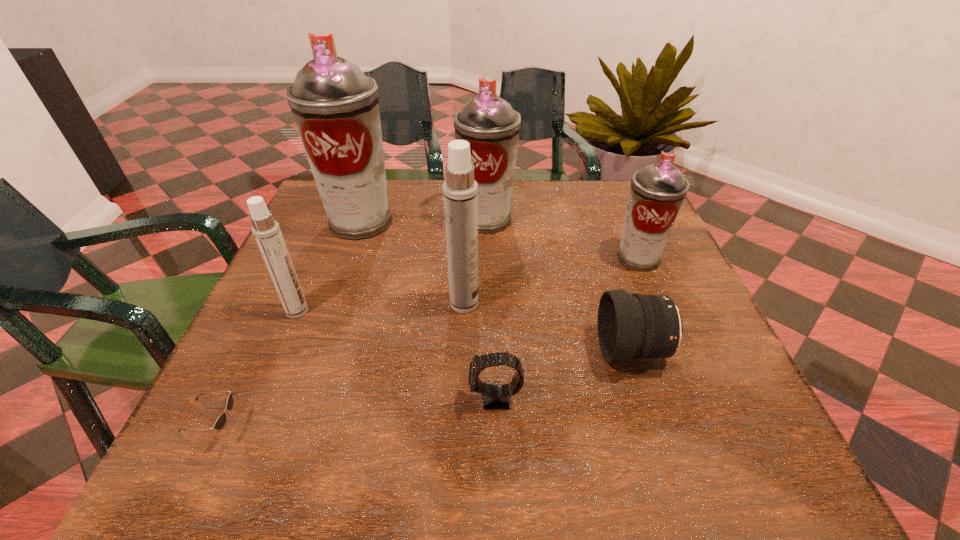
Locate an element on the screen. free spot between the sunglasses and the telephoto lens is located at coordinates (426, 390).

Image resolution: width=960 pixels, height=540 pixels. I want to click on vacant point located between the sunglasses and the telephoto lens, so click(426, 390).

This screenshot has height=540, width=960. In order to click on free spot between the smaller white aerosol can and the sunglasses in this screenshot , I will do tap(258, 370).

Find the location of a particular element. This screenshot has width=960, height=540. free space between the biggest gray aerosol can and the sunglasses is located at coordinates (290, 325).

What are the coordinates of `unoccupied position between the bigger white aerosol can and the leftmost gray aerosol can` in the screenshot? It's located at (412, 262).

Select which object appears as the sixth closest to the third nearest object. Please provide its 2D coordinates. Your answer should be formatted as a tuple, i.e. [(x, y)], where the tuple contains the x and y coordinates of a point satisfying the conditions above.

[(267, 233)]

Locate an element on the screen. The width and height of the screenshot is (960, 540). the fourth closest object to the bigger white aerosol can is located at coordinates (335, 106).

The height and width of the screenshot is (540, 960). In order to click on aerosol can that stands as the second closest to the second biggest gray aerosol can in this screenshot , I will do `click(460, 191)`.

Select which aerosol can appears as the fourth closest to the rightmost gray aerosol can. Please provide its 2D coordinates. Your answer should be formatted as a tuple, i.e. [(x, y)], where the tuple contains the x and y coordinates of a point satisfying the conditions above.

[(267, 233)]

I want to click on the second closest gray aerosol can relative to the black sunglasses, so click(490, 125).